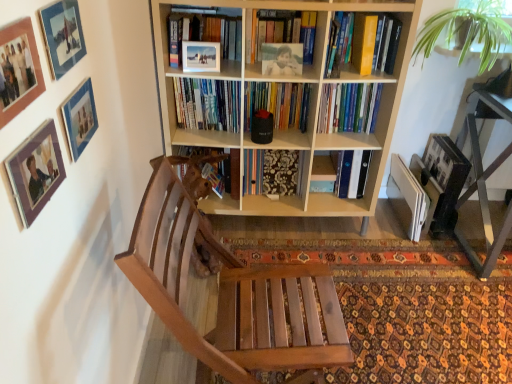
Question: Should I look upward or downward to see wooden chair at center?

Choices:
 (A) up
 (B) down

Answer: (B)

Question: Does green leafy plant at upper right appear on the right side of wooden picture frame at upper left, marked as the 4th picture frame in a top-to-bottom arrangement?

Choices:
 (A) no
 (B) yes

Answer: (B)

Question: Is green leafy plant at upper right smaller than wooden picture frame at upper left, arranged as the first picture frame when ordered from the bottom?

Choices:
 (A) yes
 (B) no

Answer: (B)

Question: Does green leafy plant at upper right have a lesser height compared to wooden picture frame at upper left, marked as the 4th picture frame in a top-to-bottom arrangement?

Choices:
 (A) yes
 (B) no

Answer: (B)

Question: Are green leafy plant at upper right and wooden picture frame at upper left, marked as the 4th picture frame in a top-to-bottom arrangement, far apart?

Choices:
 (A) no
 (B) yes

Answer: (B)

Question: From a real-world perspective, is green leafy plant at upper right under wooden picture frame at upper left, marked as the 4th picture frame in a top-to-bottom arrangement?

Choices:
 (A) no
 (B) yes

Answer: (B)

Question: Does green leafy plant at upper right contain wooden picture frame at upper left, arranged as the first picture frame when ordered from the bottom?

Choices:
 (A) no
 (B) yes

Answer: (A)

Question: Is yellow hardcover book at upper right, arranged as the first book when viewed from the top, to the right of matte blue picture frame at upper left, which is the 2th picture frame from bottom to top, from the viewer's perspective?

Choices:
 (A) yes
 (B) no

Answer: (A)

Question: Does yellow hardcover book at upper right, arranged as the first book when viewed from the top, turn towards matte blue picture frame at upper left, marked as the third picture frame in a top-to-bottom arrangement?

Choices:
 (A) yes
 (B) no

Answer: (B)

Question: Is yellow hardcover book at upper right, arranged as the first book when viewed from the top, further to camera compared to matte blue picture frame at upper left, which is the 2th picture frame from bottom to top?

Choices:
 (A) no
 (B) yes

Answer: (B)

Question: Is yellow hardcover book at upper right, the second book positioned from the bottom, positioned before matte blue picture frame at upper left, marked as the third picture frame in a top-to-bottom arrangement?

Choices:
 (A) no
 (B) yes

Answer: (A)

Question: Can you confirm if yellow hardcover book at upper right, arranged as the first book when viewed from the top, is thinner than matte blue picture frame at upper left, which is the 2th picture frame from bottom to top?

Choices:
 (A) no
 (B) yes

Answer: (A)

Question: From a real-world perspective, is yellow hardcover book at upper right, the second book positioned from the bottom, positioned under matte blue picture frame at upper left, marked as the third picture frame in a top-to-bottom arrangement, based on gravity?

Choices:
 (A) no
 (B) yes

Answer: (B)

Question: Is wooden chair at center to the right of matte glass picture frame at upper left, the 1th picture frame viewed from the top, from the viewer's perspective?

Choices:
 (A) no
 (B) yes

Answer: (B)